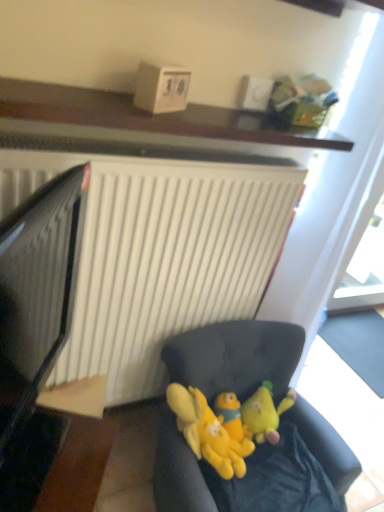
Question: Can you confirm if wooden table at lower left is bigger than black glossy computer monitor at left?

Choices:
 (A) no
 (B) yes

Answer: (A)

Question: Is wooden table at lower left further to camera compared to black glossy computer monitor at left?

Choices:
 (A) yes
 (B) no

Answer: (A)

Question: Is wooden table at lower left positioned before black glossy computer monitor at left?

Choices:
 (A) yes
 (B) no

Answer: (B)

Question: Is wooden table at lower left outside black glossy computer monitor at left?

Choices:
 (A) no
 (B) yes

Answer: (B)

Question: Is wooden table at lower left to the left of black glossy computer monitor at left from the viewer's perspective?

Choices:
 (A) no
 (B) yes

Answer: (B)

Question: Is wooden table at lower left smaller than black glossy computer monitor at left?

Choices:
 (A) yes
 (B) no

Answer: (A)

Question: Considering the relative sizes of wooden shelf at upper center and transparent glass door at upper right in the image provided, is wooden shelf at upper center shorter than transparent glass door at upper right?

Choices:
 (A) yes
 (B) no

Answer: (A)

Question: Considering the relative sizes of wooden shelf at upper center and transparent glass door at upper right in the image provided, is wooden shelf at upper center thinner than transparent glass door at upper right?

Choices:
 (A) yes
 (B) no

Answer: (A)

Question: Does wooden shelf at upper center turn towards transparent glass door at upper right?

Choices:
 (A) yes
 (B) no

Answer: (B)

Question: Does wooden shelf at upper center come in front of transparent glass door at upper right?

Choices:
 (A) no
 (B) yes

Answer: (B)

Question: Is wooden shelf at upper center bigger than transparent glass door at upper right?

Choices:
 (A) yes
 (B) no

Answer: (B)

Question: Can we say wooden shelf at upper center lies outside transparent glass door at upper right?

Choices:
 (A) no
 (B) yes

Answer: (B)

Question: From a real-world perspective, is black glossy computer monitor at left under soft fabric couch at lower center?

Choices:
 (A) no
 (B) yes

Answer: (A)